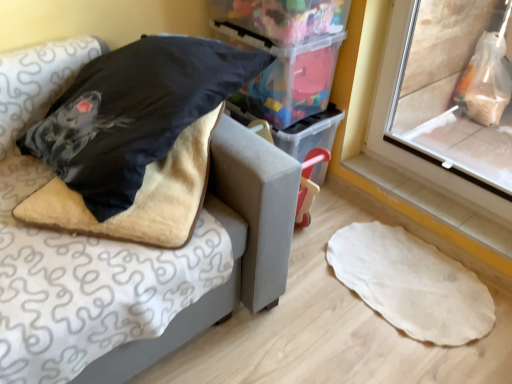
At what (x,y) coordinates should I click in order to perform the action: click on free point above white felt rug at lower right (from a real-world perspective). Please return your answer as a coordinate pair (x, y). The image size is (512, 384). Looking at the image, I should click on (418, 284).